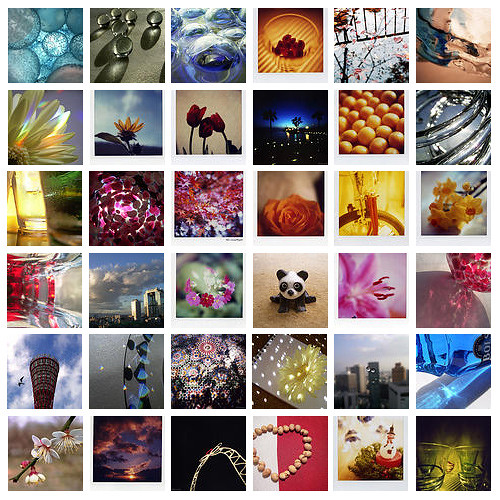
Find the location of a particular element. This screenshot has height=500, width=500. boxes in 3rd row from bottom is located at coordinates (40, 282), (114, 289), (200, 287), (284, 283), (353, 281), (461, 273).